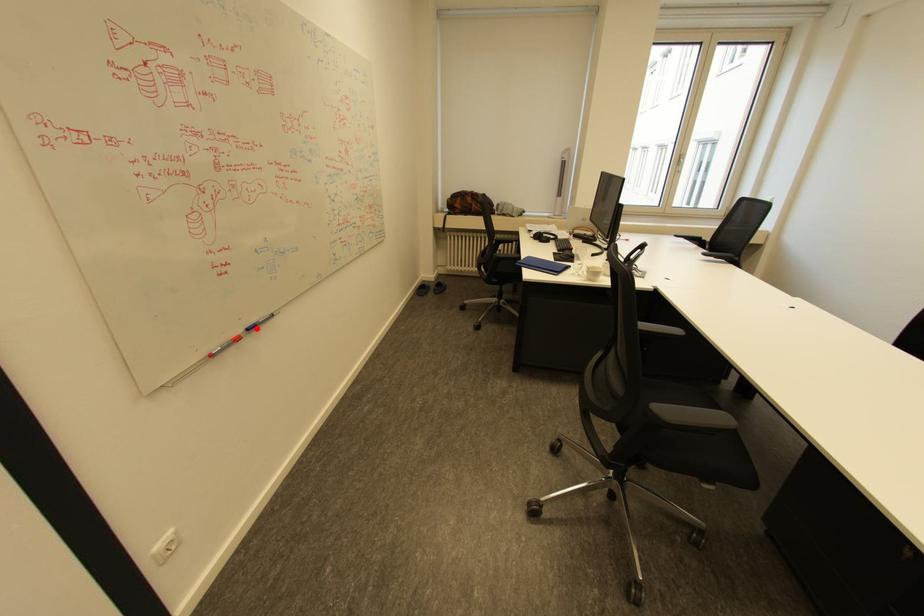
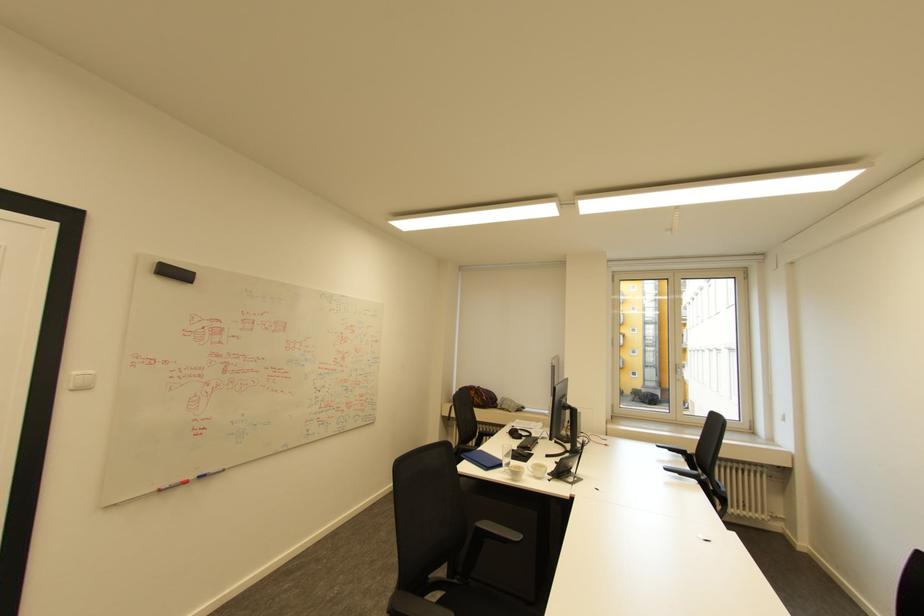
Where in the second image is the point corresponding to the highlighted location from the first image?

(207, 477)